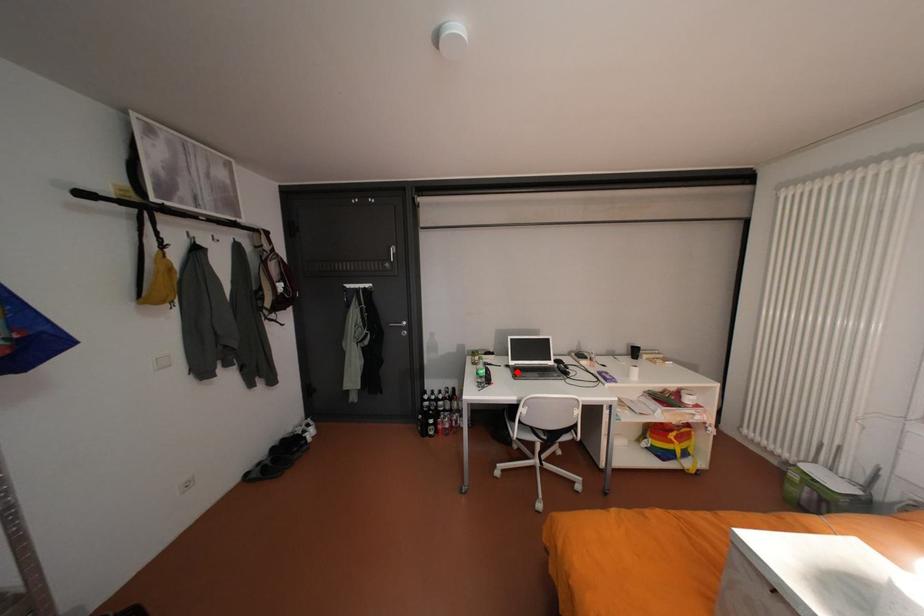
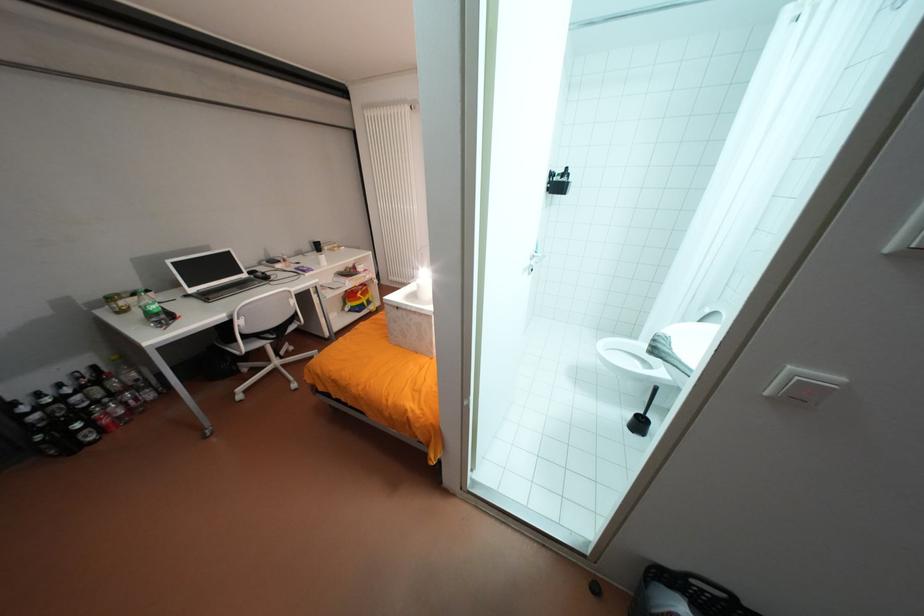
Where in the second image is the point corresponding to the highlighted location from the first image?

(203, 302)